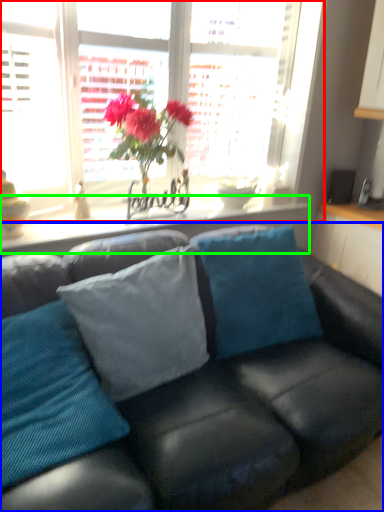
Question: Estimate the real-world distances between objects in this image. Which object is farther from window (highlighted by a red box), studio couch (highlighted by a blue box) or window sill (highlighted by a green box)?

Choices:
 (A) studio couch
 (B) window sill

Answer: (A)